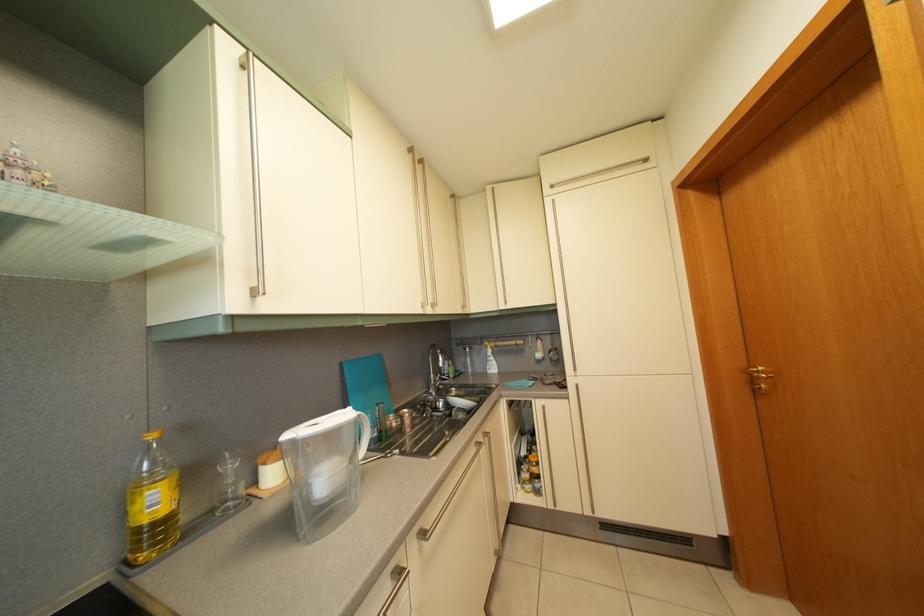
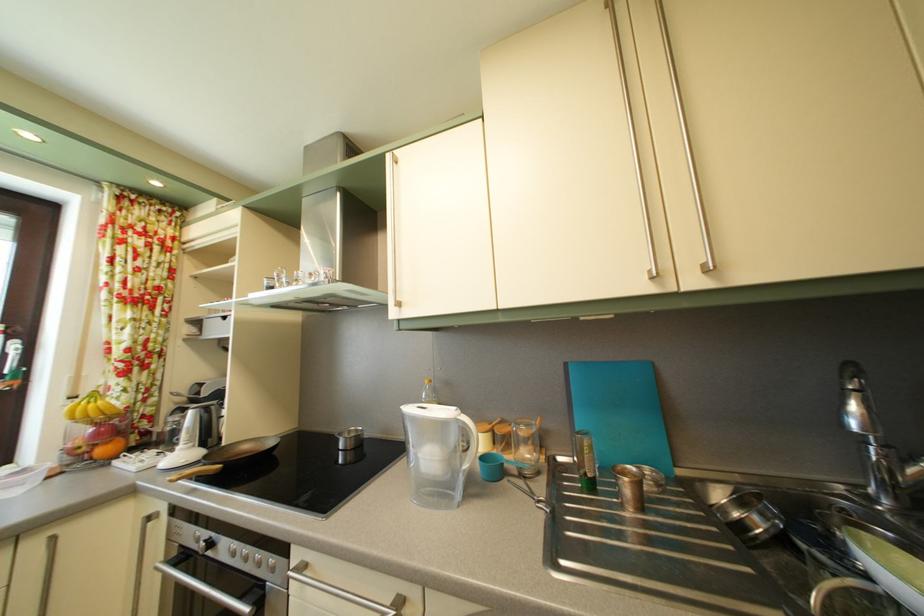
Question: The first image is from the beginning of the video and the second image is from the end. How did the camera likely rotate when shooting the video?

Choices:
 (A) Left
 (B) Right
 (C) Up
 (D) Down

Answer: (A)